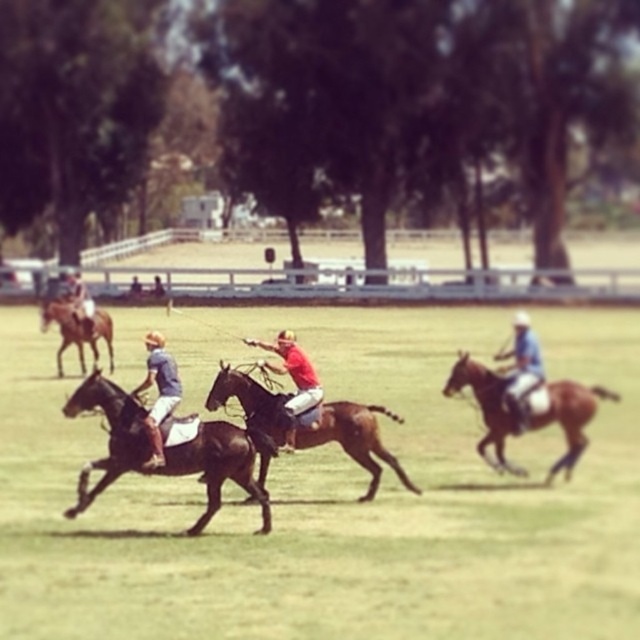
Question: Which point is farther to the camera?

Choices:
 (A) brown glossy horse at right
 (B) matte black horse at center
 (C) red cotton polo shirt at center
 (D) brown glossy horse at center

Answer: (B)

Question: Can you confirm if brown leather horse at center is smaller than matte black horse at center?

Choices:
 (A) yes
 (B) no

Answer: (B)

Question: Does brown glossy horse at center have a lesser width compared to matte blue polo shirt at center?

Choices:
 (A) yes
 (B) no

Answer: (B)

Question: Is brown glossy horse at left wider than matte black horse at center?

Choices:
 (A) no
 (B) yes

Answer: (B)

Question: Which of the following is the closest to the observer?

Choices:
 (A) (244, 342)
 (B) (566, 477)
 (C) (88, 301)
 (D) (72, 308)

Answer: (B)

Question: Which point is closer to the camera taking this photo?

Choices:
 (A) (310, 403)
 (B) (374, 468)
 (C) (109, 362)
 (D) (520, 413)

Answer: (A)